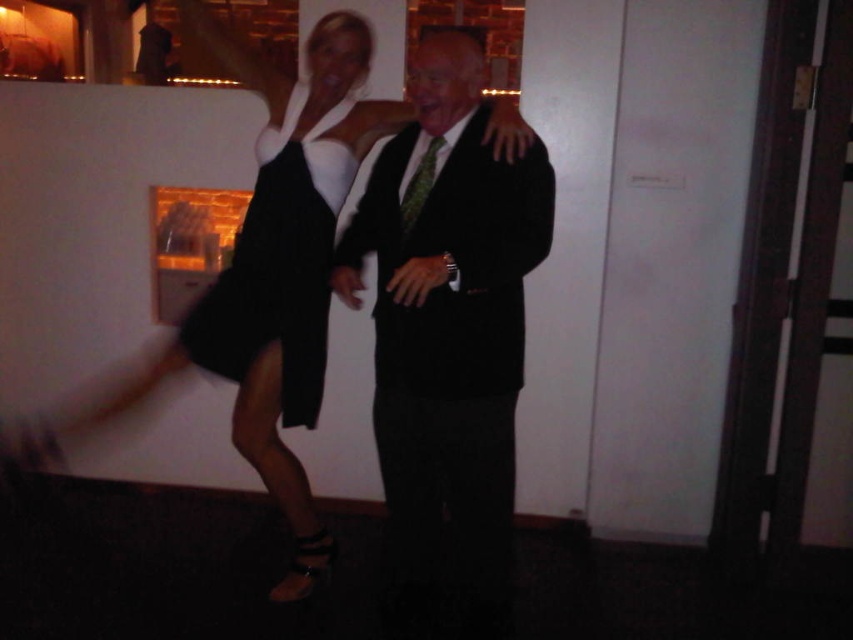
You are a photographer trying to capture the perfect shot of the black matte dress at center. The camera is positioned at the point with coordinates point (279, 268). Will the camera be able to clearly capture the black matte dress at center in this position?

The point (279, 268) corresponds to the black matte dress at center, so yes, the camera positioned there will clearly capture the black matte dress at center.

Consider the image. You are a photographer trying to capture a closeup of both the black matte suit at center and the black satin dress at center. Can you fit both into the frame if your camera has a minimum focus distance of 16 inches?

The black matte suit at center is 16.62 inches away from the black satin dress at center. Since the minimum focus distance is 16 inches, the camera can focus on both as the distance between them is just over the required minimum.

Looking at this image, you are a photographer trying to capture a clear shot of both the black matte dress at center and the green textured tie at center. Which one is closer to you?

The black matte dress at center is closer to you than the green textured tie at center.